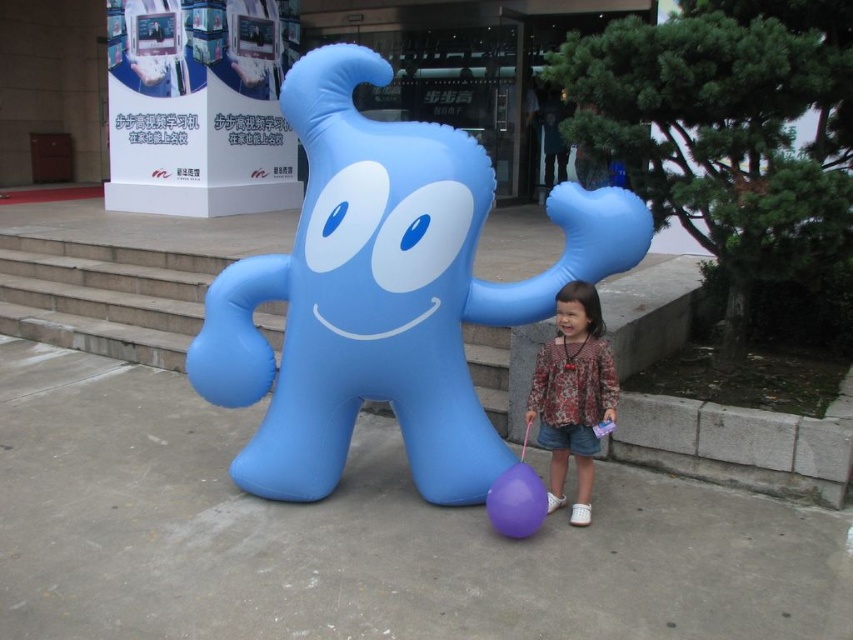
Question: Estimate the real-world distances between objects in this image. Which object is closer to the matte blue inflatable at center?

Choices:
 (A) floral fabric dress at lower right
 (B) purple rubber balloon at lower center

Answer: (A)

Question: Does matte blue inflatable at center lie behind floral fabric dress at lower right?

Choices:
 (A) yes
 (B) no

Answer: (B)

Question: Can you confirm if matte blue inflatable at center is positioned to the left of purple rubber balloon at lower center?

Choices:
 (A) no
 (B) yes

Answer: (B)

Question: Which point is closer to the camera taking this photo?

Choices:
 (A) (511, 536)
 (B) (384, 80)

Answer: (A)

Question: Does matte blue inflatable at center appear under floral fabric dress at lower right?

Choices:
 (A) yes
 (B) no

Answer: (B)

Question: Which point is farther to the camera?

Choices:
 (A) (444, 388)
 (B) (605, 403)

Answer: (A)